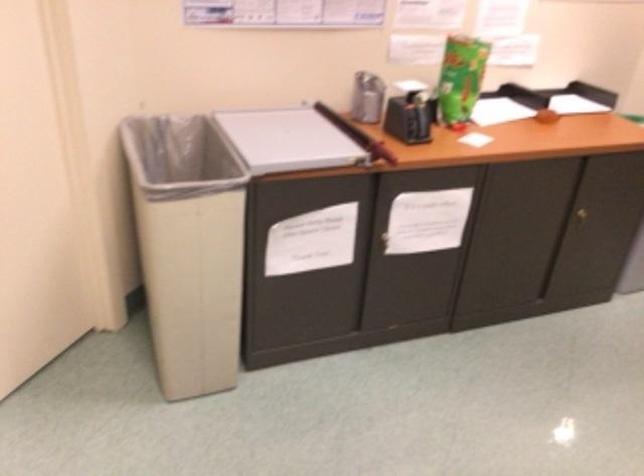
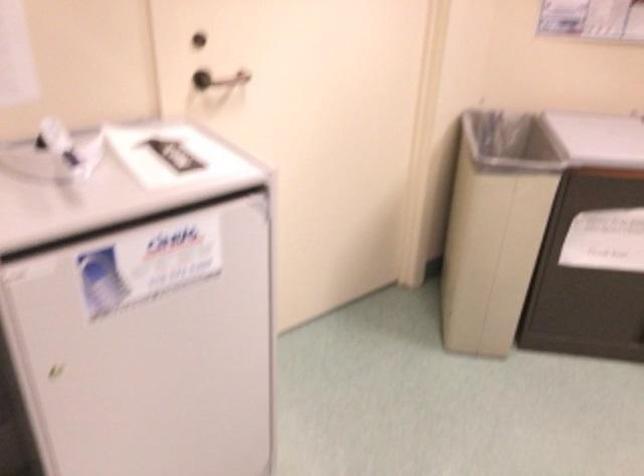
Where in the second image is the point corresponding to the point at 185,254 from the first image?

(494, 227)